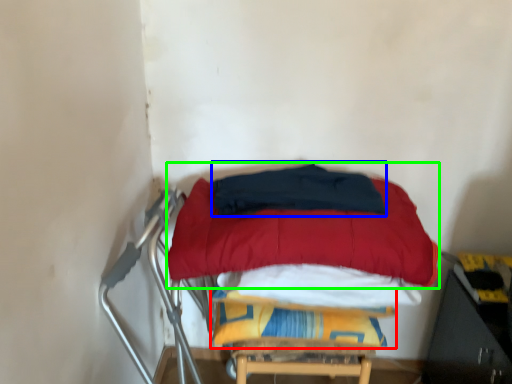
Question: Which object is the farthest from blanket (highlighted by a red box)? Choose among these: blanket (highlighted by a blue box) or mattress (highlighted by a green box).

Choices:
 (A) blanket
 (B) mattress

Answer: (A)